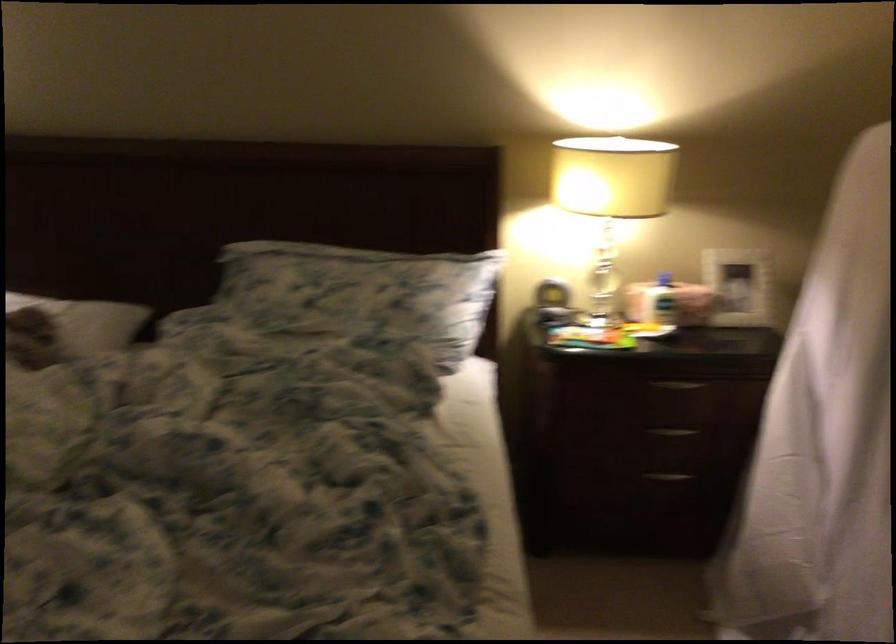
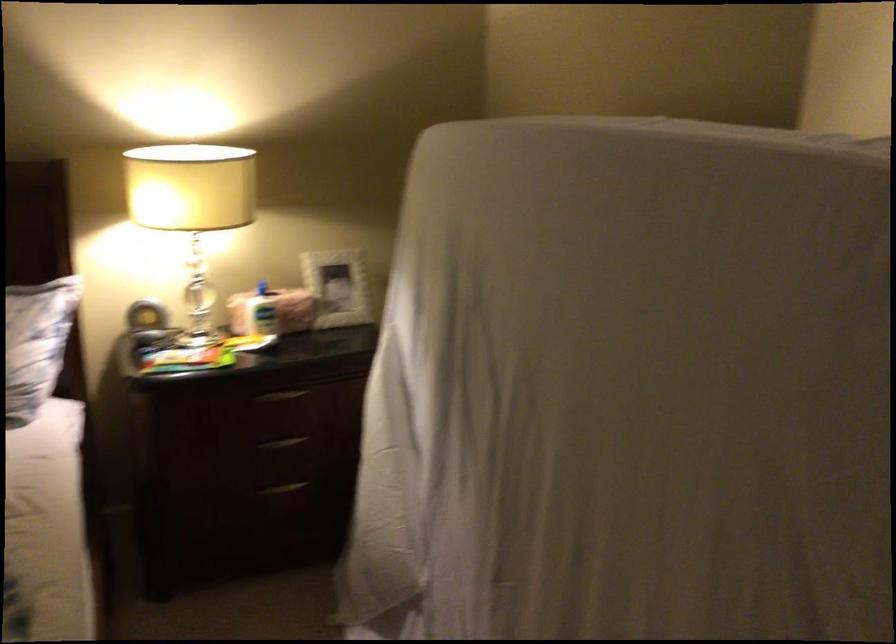
Find the pixel in the second image that matches (x=681, y=381) in the first image.

(280, 395)